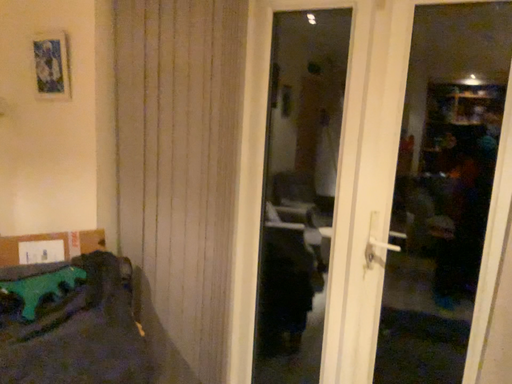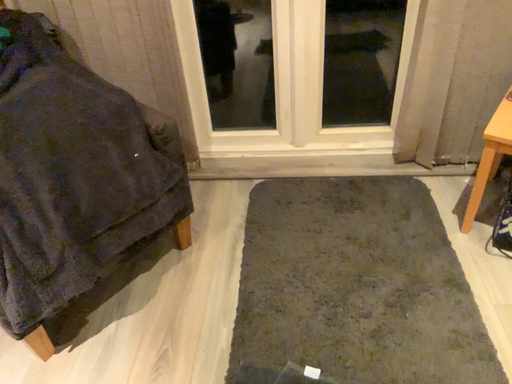
Question: Which way did the camera rotate in the video?

Choices:
 (A) rotated left
 (B) rotated right

Answer: (B)